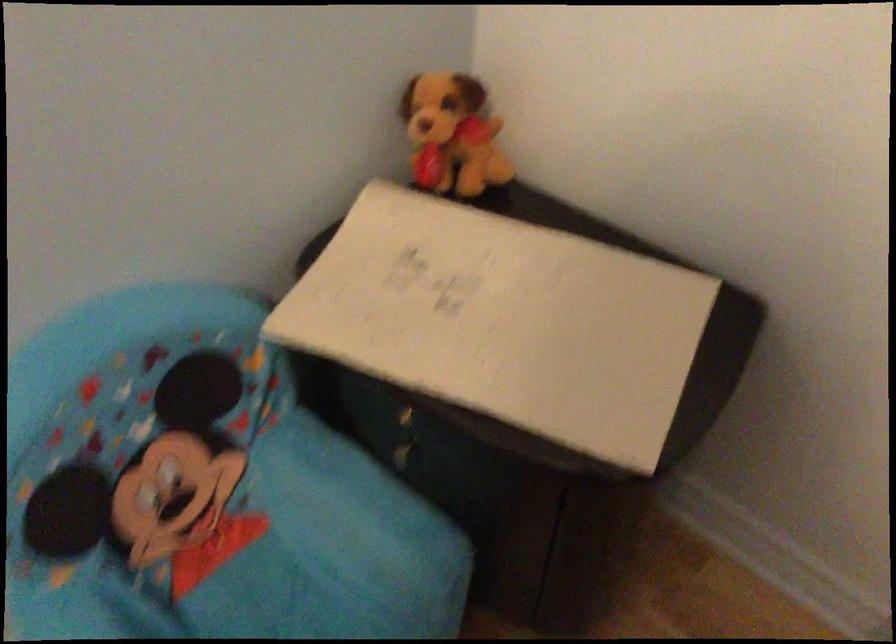
This screenshot has width=896, height=644. What do you see at coordinates (403, 438) in the screenshot?
I see `the gold drawer handle` at bounding box center [403, 438].